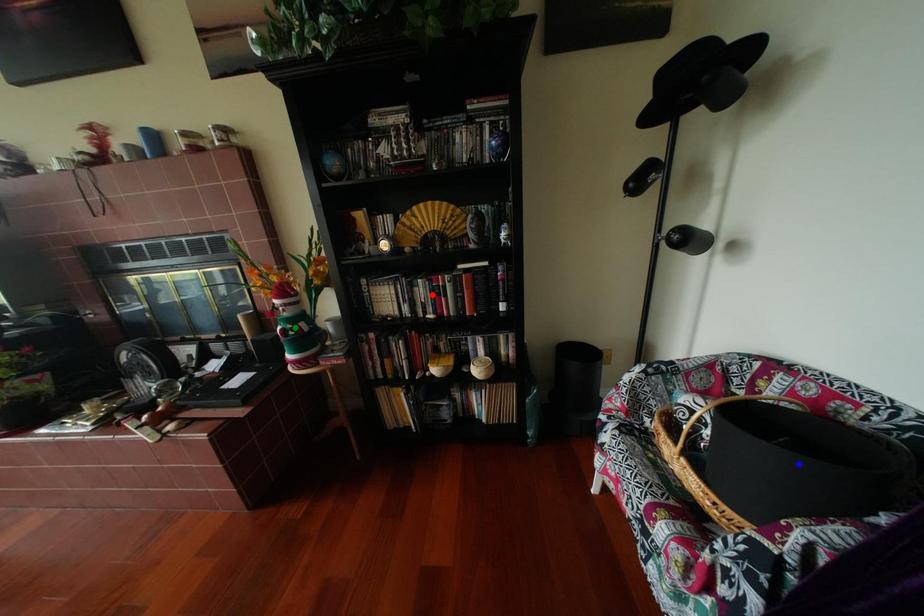
Order these from nearest to farthest:
A) blue point
B) green point
C) red point

blue point
red point
green point